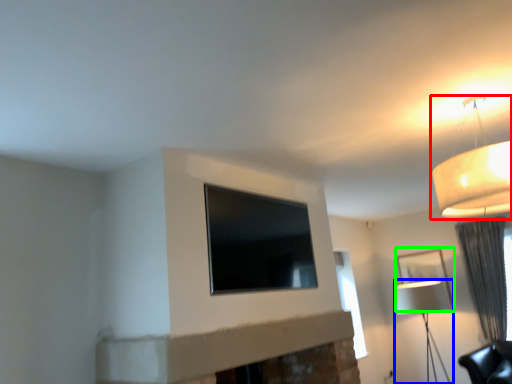
Question: Considering the real-world distances, which object is farthest from lamp (highlighted by a red box)? lamp (highlighted by a blue box) or picture frame (highlighted by a green box)?

Choices:
 (A) lamp
 (B) picture frame

Answer: (A)